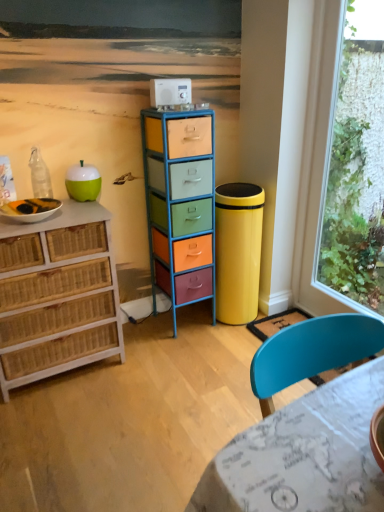
Question: Is green matte apple at left at the back of marble-patterned table at lower right?

Choices:
 (A) no
 (B) yes

Answer: (B)

Question: Is marble-patterned table at lower right located outside green matte apple at left?

Choices:
 (A) yes
 (B) no

Answer: (A)

Question: Is marble-patterned table at lower right wider than green matte apple at left?

Choices:
 (A) yes
 (B) no

Answer: (A)

Question: From a real-world perspective, is marble-patterned table at lower right positioned over green matte apple at left based on gravity?

Choices:
 (A) no
 (B) yes

Answer: (A)

Question: Can you confirm if marble-patterned table at lower right is bigger than green matte apple at left?

Choices:
 (A) yes
 (B) no

Answer: (A)

Question: Looking at their shapes, would you say transparent glass window at right is wider or thinner than woven wood chest of drawers at left, placed as the 2th chest of drawers when sorted from right to left?

Choices:
 (A) wide
 (B) thin

Answer: (B)

Question: From the image's perspective, relative to woven wood chest of drawers at left, placed as the 2th chest of drawers when sorted from right to left, is transparent glass window at right above or below?

Choices:
 (A) below
 (B) above

Answer: (B)

Question: In terms of height, does transparent glass window at right look taller or shorter compared to woven wood chest of drawers at left, the 1th chest of drawers from the left?

Choices:
 (A) tall
 (B) short

Answer: (A)

Question: Would you say transparent glass window at right is to the left or to the right of woven wood chest of drawers at left, placed as the 2th chest of drawers when sorted from right to left, in the picture?

Choices:
 (A) right
 (B) left

Answer: (A)

Question: Is woven wood chest of drawers at left, the 1th chest of drawers from the left, taller or shorter than metallic multicolored drawers at center, placed as the 1th chest of drawers when sorted from right to left?

Choices:
 (A) tall
 (B) short

Answer: (B)

Question: Would you say woven wood chest of drawers at left, the 1th chest of drawers from the left, is to the left or to the right of metallic multicolored drawers at center, which is counted as the 2th chest of drawers, starting from the left, in the picture?

Choices:
 (A) left
 (B) right

Answer: (A)

Question: Looking at the image, does woven wood chest of drawers at left, placed as the 2th chest of drawers when sorted from right to left, seem bigger or smaller compared to metallic multicolored drawers at center, which is counted as the 2th chest of drawers, starting from the left?

Choices:
 (A) big
 (B) small

Answer: (A)

Question: From a real-world perspective, is woven wood chest of drawers at left, the 1th chest of drawers from the left, above or below metallic multicolored drawers at center, which is counted as the 2th chest of drawers, starting from the left?

Choices:
 (A) below
 (B) above

Answer: (A)

Question: Considering the positions of white plastic appliance at upper center and transparent glass window at right in the image, is white plastic appliance at upper center bigger or smaller than transparent glass window at right?

Choices:
 (A) big
 (B) small

Answer: (B)

Question: Relative to transparent glass window at right, is white plastic appliance at upper center in front or behind?

Choices:
 (A) front
 (B) behind

Answer: (B)